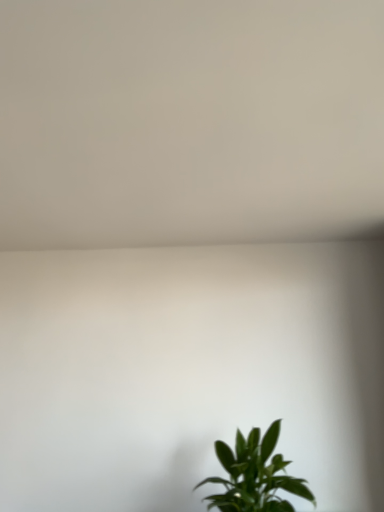
Identify the location of green leafy plant at lower right. click(254, 475).

Describe the element at coordinates (254, 475) in the screenshot. The height and width of the screenshot is (512, 384). I see `green leafy plant at lower right` at that location.

Where is `green leafy plant at lower right`? green leafy plant at lower right is located at coordinates (254, 475).